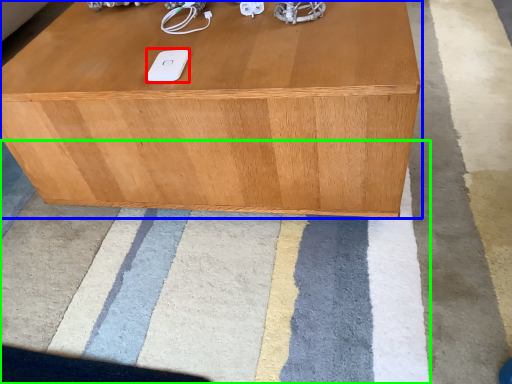
Question: Which object is positioned closest to ipod (highlighted by a red box)? Select from table (highlighted by a blue box) and mat (highlighted by a green box).

Choices:
 (A) table
 (B) mat

Answer: (A)